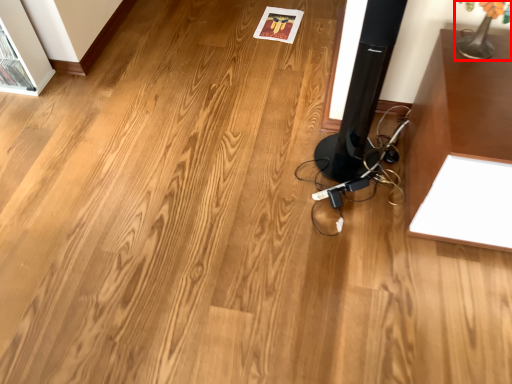
Question: In this image, where is table lamp (annotated by the red box) located relative to speaker?

Choices:
 (A) right
 (B) left

Answer: (A)